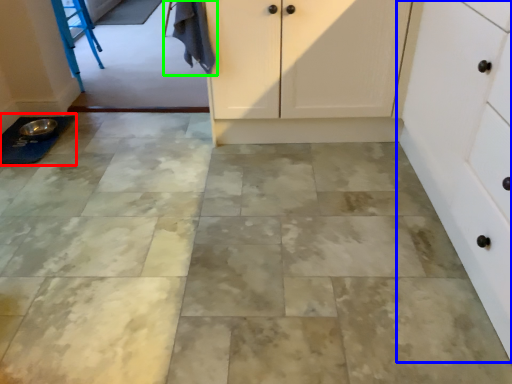
Question: Estimate the real-world distances between objects in this image. Which object is farther from sink (highlighted by a red box), cabinetry (highlighted by a blue box) or laundry (highlighted by a green box)?

Choices:
 (A) cabinetry
 (B) laundry

Answer: (A)